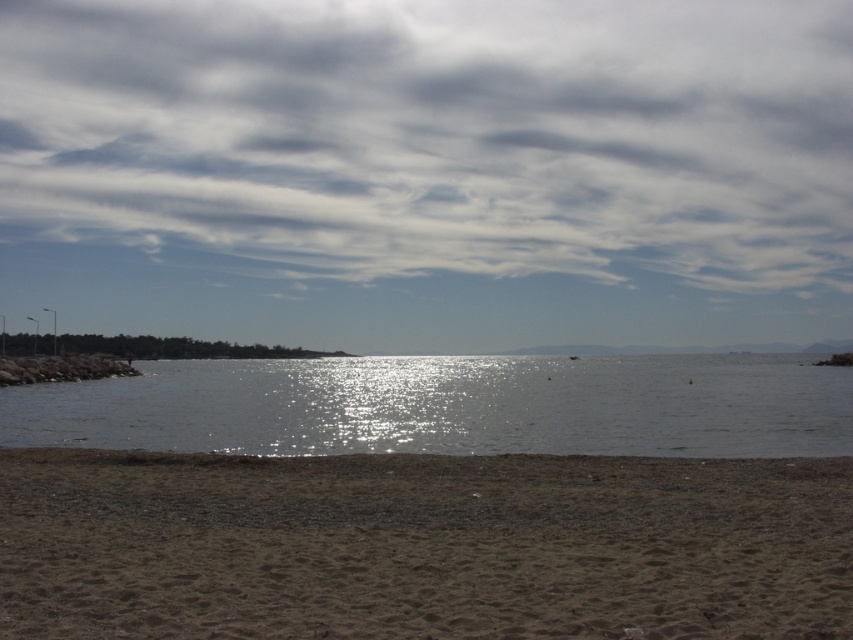
You are standing on the brown sandy beach at lower center and want to reach the glistening water at center. Considering their heights, which direction should you move to get to the water?

The brown sandy beach at lower center has a lesser height compared to the glistening water at center, so you should move upward towards the glistening water at center to reach it.

You are standing on the beach and want to take a photo of the cloudy sky at upper center and the glistening water at center. Which object should you point your camera towards first if you want to capture both in a single frame without moving the camera?

You should point your camera towards the glistening water at center first because the cloudy sky at upper center is to the right of it, allowing both to be captured in the frame.

What is the 2D coordinate of the cloudy sky at upper center in the image?

The cloudy sky at upper center is located at the 2D coordinate point of (439, 136).